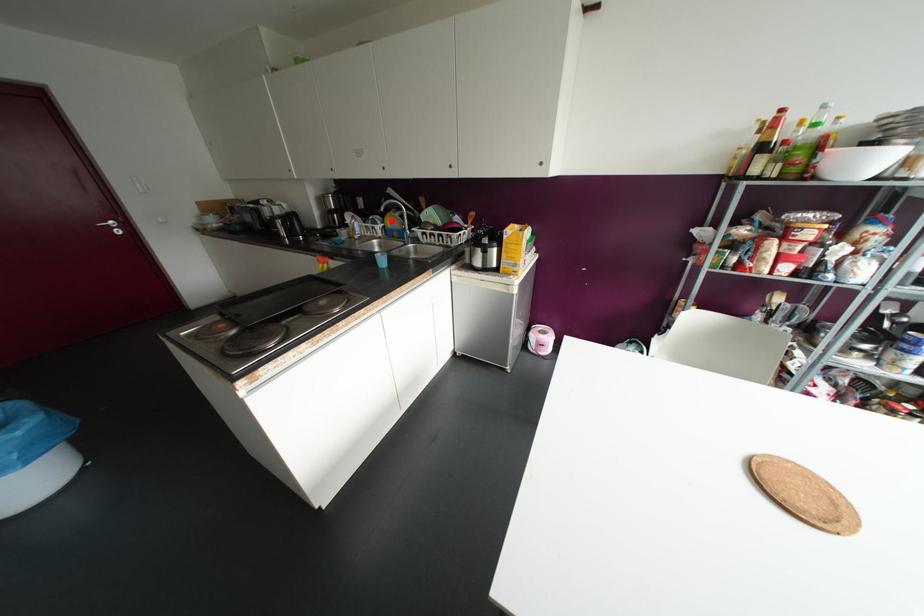
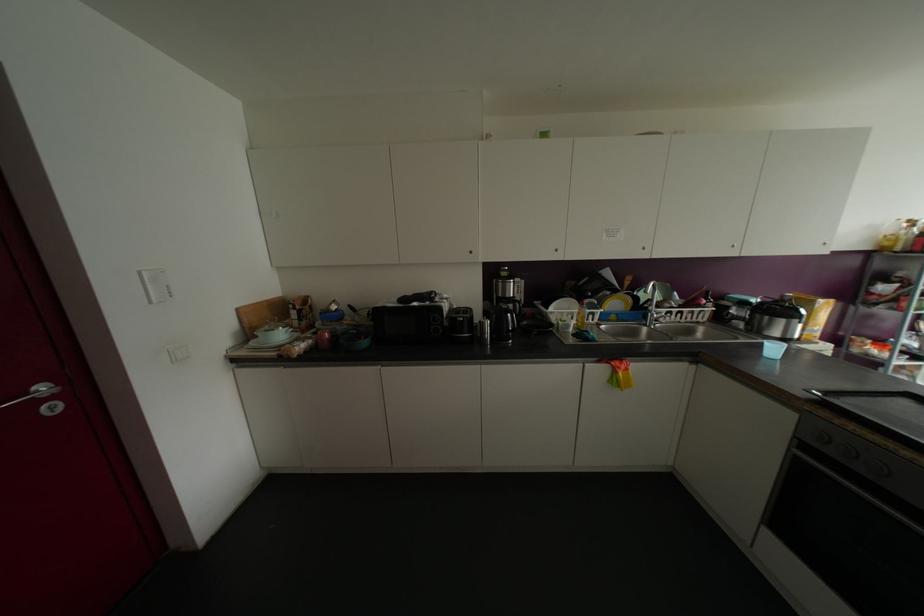
Question: I am providing you with two images of the same scene from different viewpoints. Given a red point in image1, look at the same physical point in image2. Is it:

Choices:
 (A) Closer to the viewpoint
 (B) Farther from the viewpoint

Answer: (B)